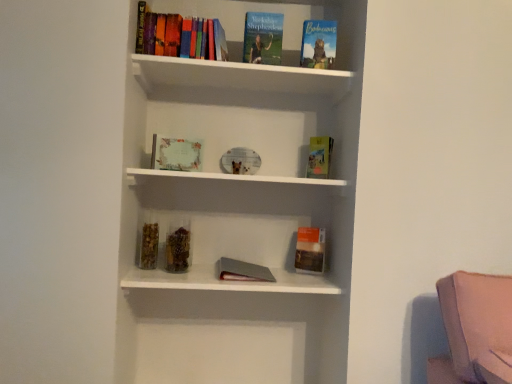
Question: Is hardcover book at upper right, placed as the 1th book when sorted from right to left, oriented away from matte paper certificate at center, marked as the 1th book in a left-to-right arrangement?

Choices:
 (A) yes
 (B) no

Answer: (B)

Question: Is hardcover book at upper right, positioned as the 4th book in left-to-right order, not within matte paper certificate at center, marked as the 1th book in a left-to-right arrangement?

Choices:
 (A) no
 (B) yes

Answer: (B)

Question: Can you confirm if hardcover book at upper right, placed as the 1th book when sorted from right to left, is smaller than matte paper certificate at center, marked as the 1th book in a left-to-right arrangement?

Choices:
 (A) yes
 (B) no

Answer: (A)

Question: Is matte paper certificate at center, marked as the 1th book in a left-to-right arrangement, inside hardcover book at upper right, placed as the 1th book when sorted from right to left?

Choices:
 (A) yes
 (B) no

Answer: (B)

Question: From the image's perspective, is hardcover book at upper right, placed as the 1th book when sorted from right to left, located beneath matte paper certificate at center, arranged as the 4th book when viewed from the right?

Choices:
 (A) no
 (B) yes

Answer: (A)

Question: Could you tell me if hardcover book at upper right, positioned as the 4th book in left-to-right order, is facing matte paper certificate at center, marked as the 1th book in a left-to-right arrangement?

Choices:
 (A) no
 (B) yes

Answer: (A)

Question: Can you confirm if hardcover book at upper center, marked as the 2th book in a left-to-right arrangement, is thinner than matte paper certificate at center, marked as the 1th book in a left-to-right arrangement?

Choices:
 (A) no
 (B) yes

Answer: (A)

Question: From a real-world perspective, is hardcover book at upper center, marked as the 2th book in a left-to-right arrangement, physically below matte paper certificate at center, arranged as the 4th book when viewed from the right?

Choices:
 (A) no
 (B) yes

Answer: (A)

Question: Is hardcover book at upper center, which is the third book from right to left, at the right side of matte paper certificate at center, marked as the 1th book in a left-to-right arrangement?

Choices:
 (A) no
 (B) yes

Answer: (B)

Question: Can you see hardcover book at upper center, which is the third book from right to left, touching matte paper certificate at center, arranged as the 4th book when viewed from the right?

Choices:
 (A) yes
 (B) no

Answer: (B)

Question: From the image's perspective, would you say hardcover book at upper center, which is the third book from right to left, is positioned over matte paper certificate at center, arranged as the 4th book when viewed from the right?

Choices:
 (A) no
 (B) yes

Answer: (B)

Question: Is hardcover book at upper center, which is the third book from right to left, positioned before matte paper certificate at center, arranged as the 4th book when viewed from the right?

Choices:
 (A) yes
 (B) no

Answer: (A)

Question: Considering the relative sizes of matte paper certificate at center, arranged as the 4th book when viewed from the right, and hardcover book at center, which ranks as the 2th paperback book in bottom-to-top order, in the image provided, is matte paper certificate at center, arranged as the 4th book when viewed from the right, taller than hardcover book at center, which ranks as the 2th paperback book in bottom-to-top order,?

Choices:
 (A) no
 (B) yes

Answer: (A)